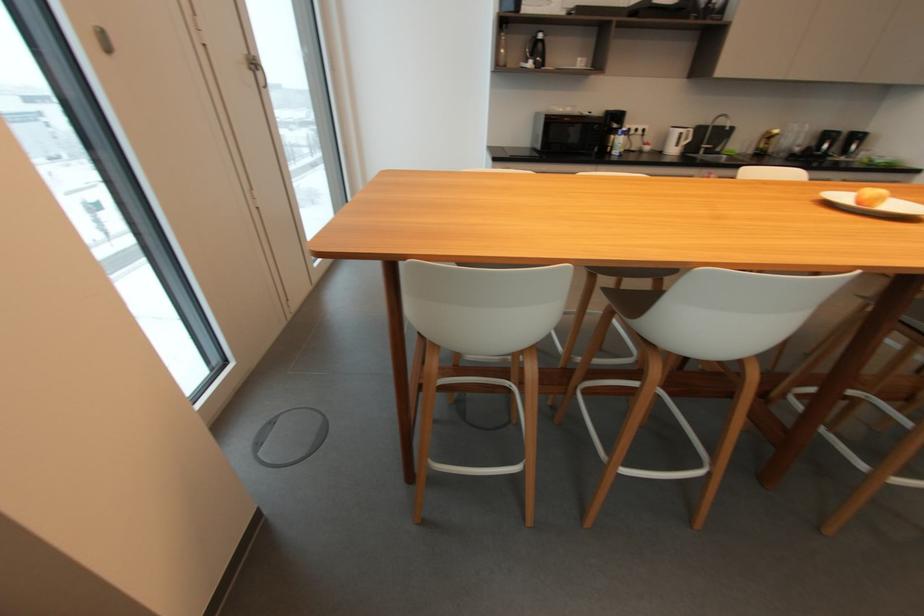
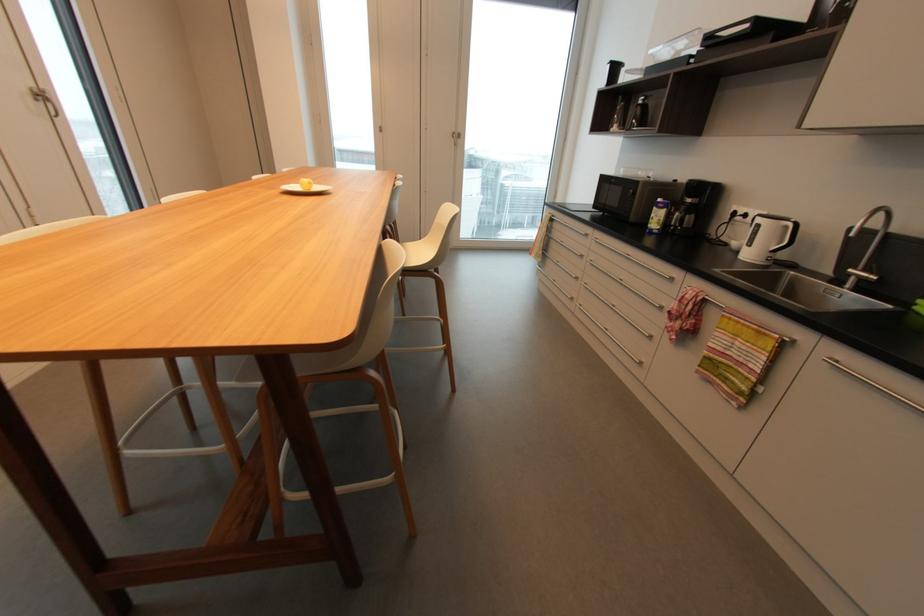
In the second image, find the point that corresponds to [691,132] in the first image.

(789, 227)